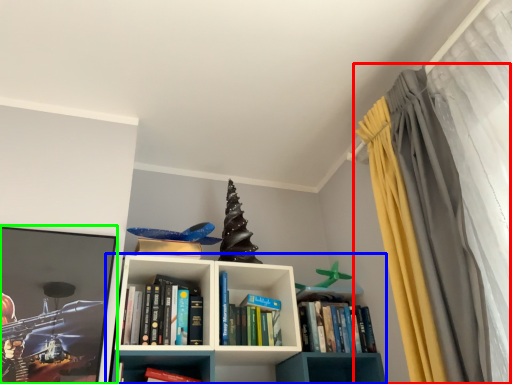
Question: Which is nearer to the curtain (highlighted by a red box)? shelf (highlighted by a blue box) or picture frame (highlighted by a green box).

Choices:
 (A) shelf
 (B) picture frame

Answer: (A)